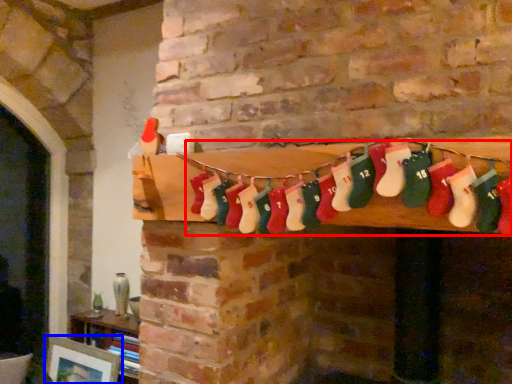
Question: Among these objects, which one is nearest to the camera, sock (highlighted by a red box) or picture frame (highlighted by a blue box)?

Choices:
 (A) sock
 (B) picture frame

Answer: (A)